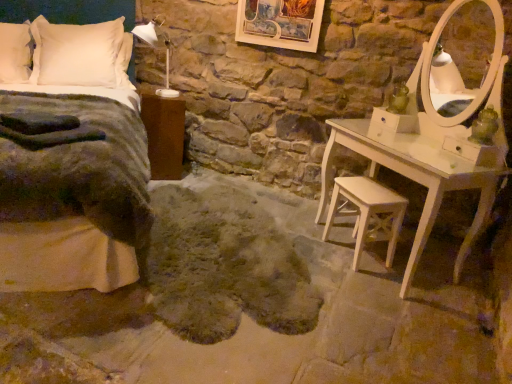
Image resolution: width=512 pixels, height=384 pixels. Identify the location of vacant space to the right of fuzzy gray rug at center. (388, 294).